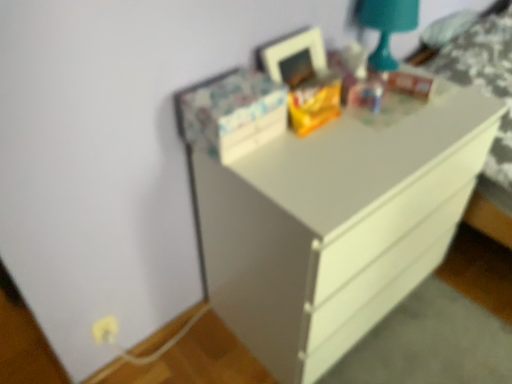
Question: Should I look upward or downward to see teal glossy lamp at upper right?

Choices:
 (A) down
 (B) up

Answer: (B)

Question: Would you say teal glossy lamp at upper right is a long distance from white glossy chest of drawers at center?

Choices:
 (A) yes
 (B) no

Answer: (B)

Question: From the image's perspective, is teal glossy lamp at upper right on top of white glossy chest of drawers at center?

Choices:
 (A) yes
 (B) no

Answer: (A)

Question: Is teal glossy lamp at upper right facing towards white glossy chest of drawers at center?

Choices:
 (A) no
 (B) yes

Answer: (A)

Question: Considering the relative positions of teal glossy lamp at upper right and white glossy chest of drawers at center in the image provided, is teal glossy lamp at upper right to the left of white glossy chest of drawers at center from the viewer's perspective?

Choices:
 (A) yes
 (B) no

Answer: (B)

Question: Is teal glossy lamp at upper right thinner than white glossy chest of drawers at center?

Choices:
 (A) no
 (B) yes

Answer: (B)

Question: Is teal glossy lamp at upper right wider than white glossy chest of drawers at center?

Choices:
 (A) yes
 (B) no

Answer: (B)

Question: Is white glossy chest of drawers at center facing away from teal glossy lamp at upper right?

Choices:
 (A) no
 (B) yes

Answer: (A)

Question: From a real-world perspective, is white glossy chest of drawers at center on teal glossy lamp at upper right?

Choices:
 (A) yes
 (B) no

Answer: (B)

Question: Is white glossy chest of drawers at center smaller than teal glossy lamp at upper right?

Choices:
 (A) yes
 (B) no

Answer: (B)

Question: Can you confirm if white glossy chest of drawers at center is bigger than teal glossy lamp at upper right?

Choices:
 (A) no
 (B) yes

Answer: (B)

Question: Is white glossy chest of drawers at center wider than teal glossy lamp at upper right?

Choices:
 (A) no
 (B) yes

Answer: (B)

Question: From a real-world perspective, is white glossy chest of drawers at center positioned under teal glossy lamp at upper right based on gravity?

Choices:
 (A) no
 (B) yes

Answer: (B)

Question: Is point (403, 19) closer or farther from the camera than point (298, 160)?

Choices:
 (A) farther
 (B) closer

Answer: (A)